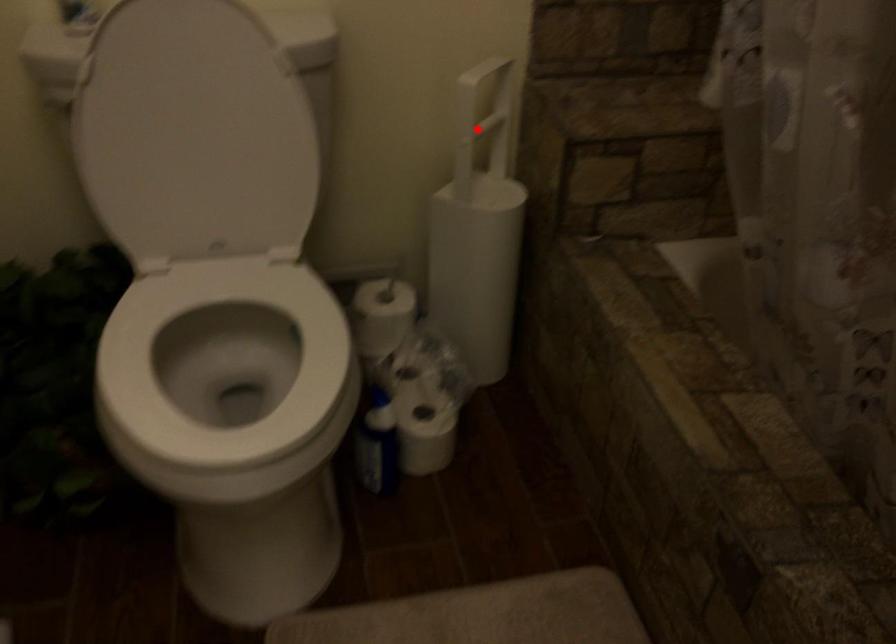
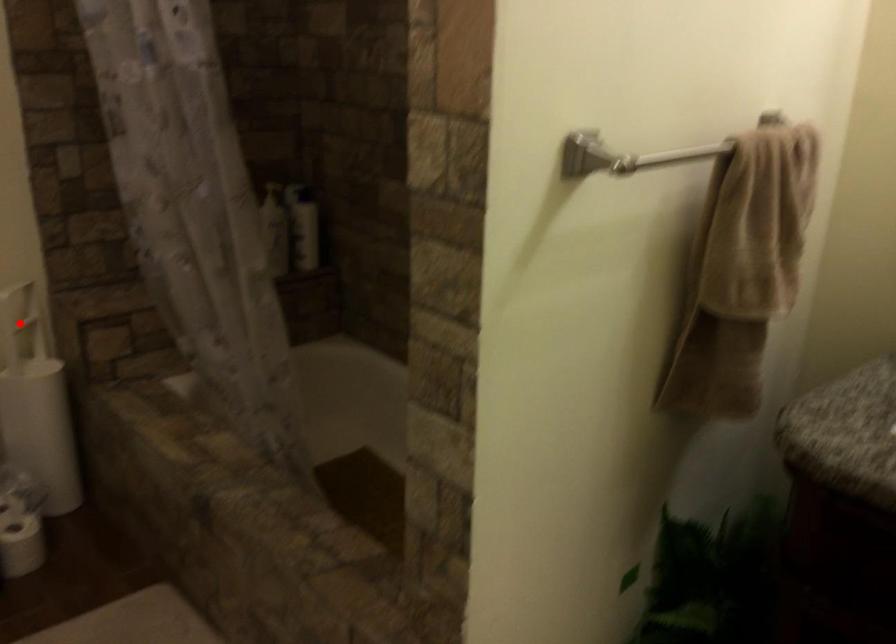
I am providing you with two images of the same scene from different viewpoints. A red point is marked on the first image and another point is marked on the second image. Are the points marked in image1 and image2 representing the same 3D position?

Yes